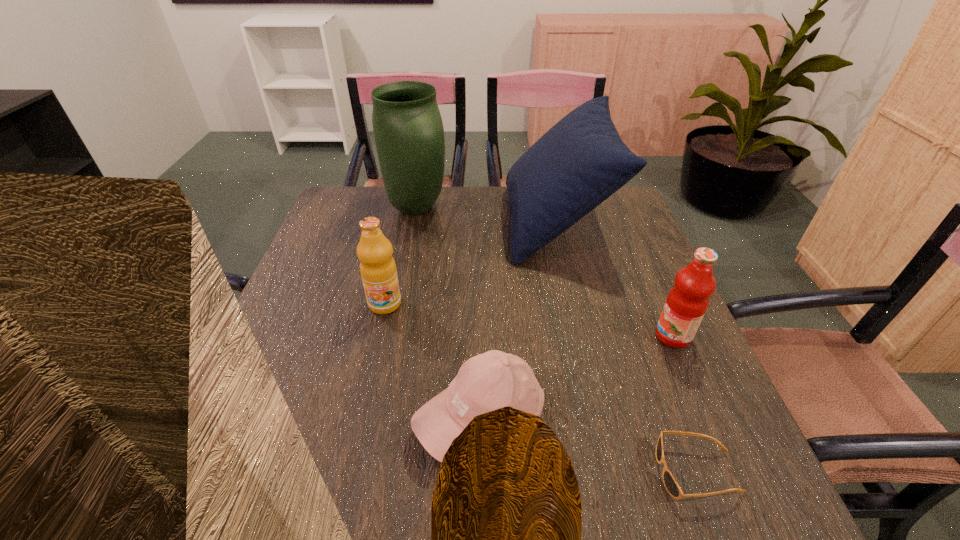
The width and height of the screenshot is (960, 540). In order to click on vase in this screenshot , I will do `click(408, 129)`.

You are a GUI agent. You are given a task and a screenshot of the screen. Output one action in this format:
    pyautogui.click(x=<x>, y=<y>)
    Task: Click on the cushion
    The height and width of the screenshot is (540, 960).
    Given the screenshot: What is the action you would take?
    pyautogui.click(x=581, y=161)

In order to click on the farther fruit juice in this screenshot , I will do `click(378, 270)`.

What are the coordinates of `the left fruit juice` in the screenshot? It's located at (378, 270).

The height and width of the screenshot is (540, 960). Find the location of `the right fruit juice`. the right fruit juice is located at coordinates (685, 306).

At what (x,y) coordinates should I click in order to perform the action: click on the third nearest object. Please return your answer as a coordinate pair (x, y). The width and height of the screenshot is (960, 540). Looking at the image, I should click on (685, 306).

This screenshot has height=540, width=960. Find the location of `the second shortest object`. the second shortest object is located at coordinates (492, 380).

This screenshot has height=540, width=960. Find the location of `the shortest object`. the shortest object is located at coordinates (672, 487).

At what (x,y) coordinates should I click in order to perform the action: click on free space located 0.210m on the front of the vase. Please return your answer as a coordinate pair (x, y). The height and width of the screenshot is (540, 960). Looking at the image, I should click on (402, 276).

Find the location of a particular element. The image size is (960, 540). vacant space located 0.300m on the facing side of the cushion is located at coordinates (405, 222).